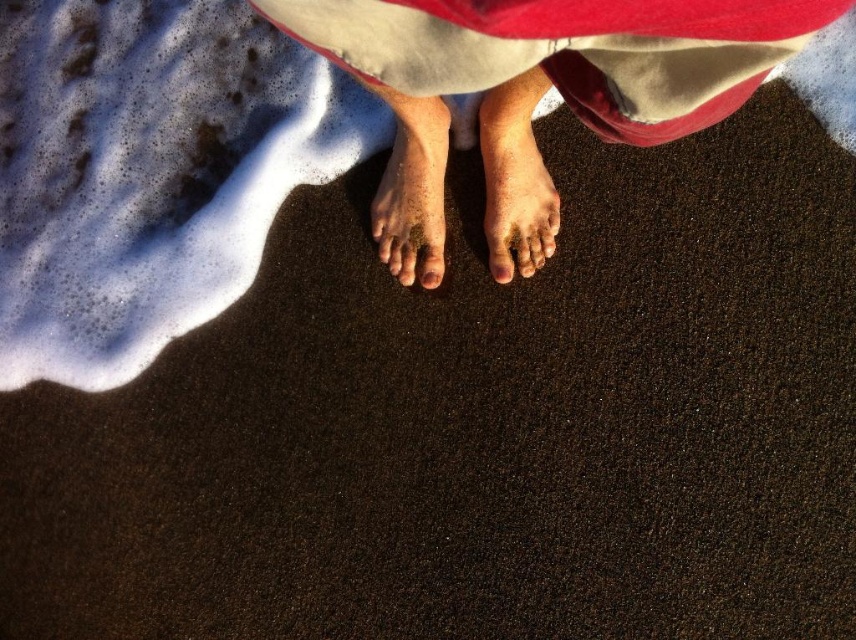
Question: Which of the following is the closest to the observer?

Choices:
 (A) (515, 84)
 (B) (409, 209)

Answer: (A)

Question: Can you confirm if smooth skin feet at center is thinner than brown sand at center?

Choices:
 (A) yes
 (B) no

Answer: (B)

Question: Where is smooth skin feet at center located in relation to dry sand foot at center in the image?

Choices:
 (A) left
 (B) right

Answer: (A)

Question: Is dry sand foot at center to the right of brown sand at center from the viewer's perspective?

Choices:
 (A) yes
 (B) no

Answer: (A)

Question: Which point is closer to the camera?

Choices:
 (A) (512, 246)
 (B) (522, 145)
 (C) (421, 268)

Answer: (B)

Question: Which point appears closest to the camera in this image?

Choices:
 (A) (535, 266)
 (B) (484, 211)

Answer: (A)